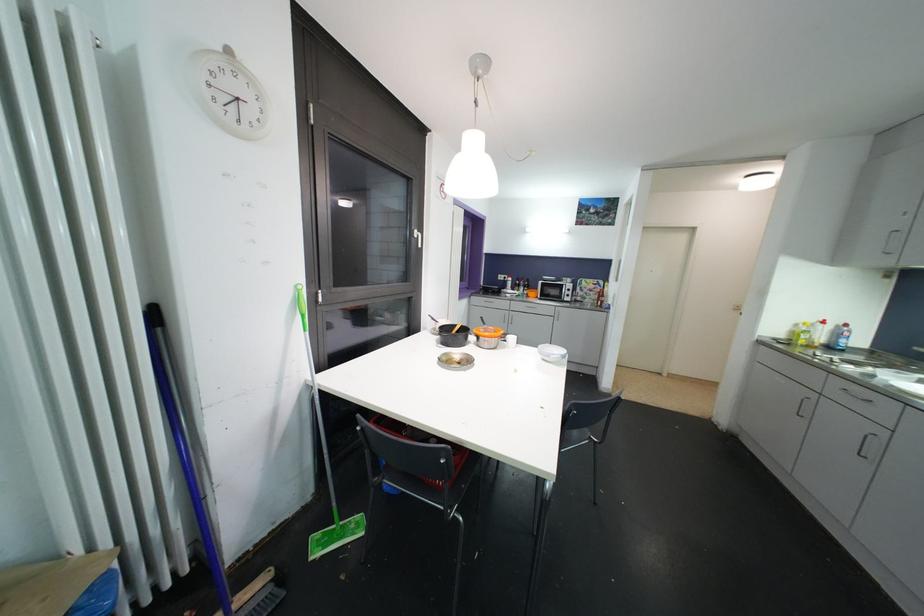
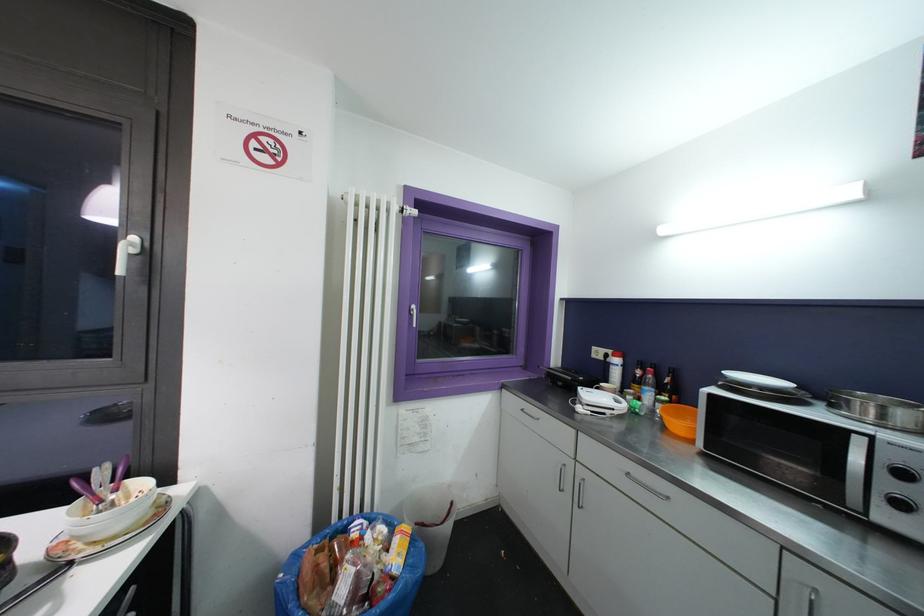
Where in the second image is the point corresponding to the point at 513,286 from the first image?

(618, 376)